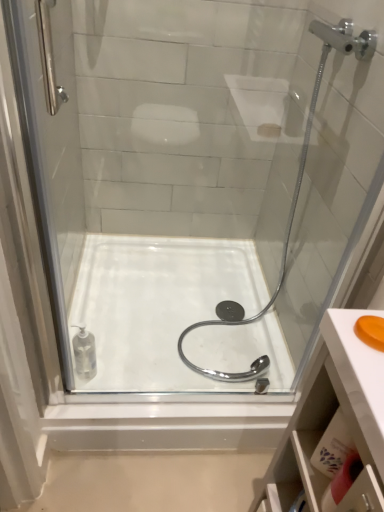
Question: Considering the positions of orange matte soap at upper right and white glossy bath at center in the image, is orange matte soap at upper right bigger or smaller than white glossy bath at center?

Choices:
 (A) big
 (B) small

Answer: (B)

Question: In terms of height, does orange matte soap at upper right look taller or shorter compared to white glossy bath at center?

Choices:
 (A) short
 (B) tall

Answer: (A)

Question: Based on their positions, is orange matte soap at upper right located to the left or right of white glossy bath at center?

Choices:
 (A) left
 (B) right

Answer: (B)

Question: From the image's perspective, is white glossy bath at center positioned above or below orange matte soap at upper right?

Choices:
 (A) above
 (B) below

Answer: (B)

Question: Is white glossy bath at center wider or thinner than orange matte soap at upper right?

Choices:
 (A) thin
 (B) wide

Answer: (B)

Question: Is white glossy bath at center taller or shorter than orange matte soap at upper right?

Choices:
 (A) tall
 (B) short

Answer: (A)

Question: In the image, is white glossy bath at center on the left side or the right side of orange matte soap at upper right?

Choices:
 (A) left
 (B) right

Answer: (A)